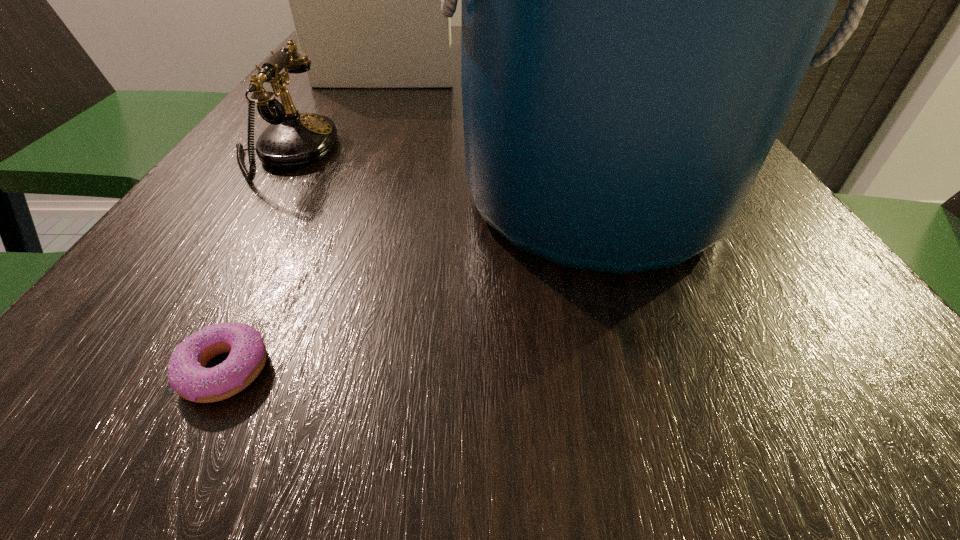
Where is `vacant space at the right edge of the desktop`? The width and height of the screenshot is (960, 540). vacant space at the right edge of the desktop is located at coordinates (844, 312).

Identify the location of vacant region at the near right corner. (830, 465).

This screenshot has height=540, width=960. Identify the location of free space between the telephone and the nearest object. (254, 261).

Locate an element on the screen. Image resolution: width=960 pixels, height=540 pixels. vacant space that's between the farthest object and the second shortest object is located at coordinates (339, 106).

At what (x,y) coordinates should I click in order to perform the action: click on free spot between the rightmost object and the second shortest object. Please return your answer as a coordinate pair (x, y). The image size is (960, 540). Looking at the image, I should click on (441, 174).

You are a GUI agent. You are given a task and a screenshot of the screen. Output one action in this format:
    pyautogui.click(x=<x>, y=<y>)
    Task: Click on the unoccupied position between the farthest object and the doughnut
    
    Given the screenshot: What is the action you would take?
    pyautogui.click(x=309, y=215)

Where is `free area in between the doughnut and the bucket`? The width and height of the screenshot is (960, 540). free area in between the doughnut and the bucket is located at coordinates (410, 284).

The image size is (960, 540). Find the location of `object that is the second closest to the bucket`. object that is the second closest to the bucket is located at coordinates (292, 140).

Where is `the second closest object to the telephone`? The image size is (960, 540). the second closest object to the telephone is located at coordinates (641, 0).

This screenshot has height=540, width=960. Find the location of `vacant space that satisfies the following two spatial constraints: 1. on the dial of the bucket; 2. on the right side of the telephone`. vacant space that satisfies the following two spatial constraints: 1. on the dial of the bucket; 2. on the right side of the telephone is located at coordinates (255, 197).